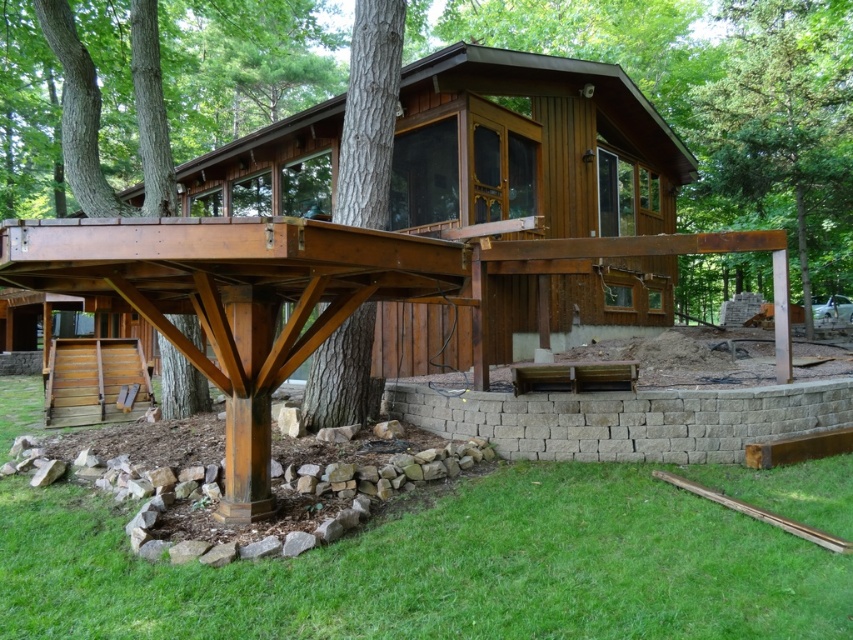
You are standing on the ground level near the gray concrete retaining wall at lower center. You want to reach the brown wooden cabin at center. Which direction should you move to get there?

The brown wooden cabin at center is above the gray concrete retaining wall at lower center, so you should move upward to reach it.

You are a contractor assessing the construction site of the brown wooden cabin at center and the gray concrete retaining wall at lower center. Which structure is taller?

The brown wooden cabin at center is much taller than the gray concrete retaining wall at lower center.